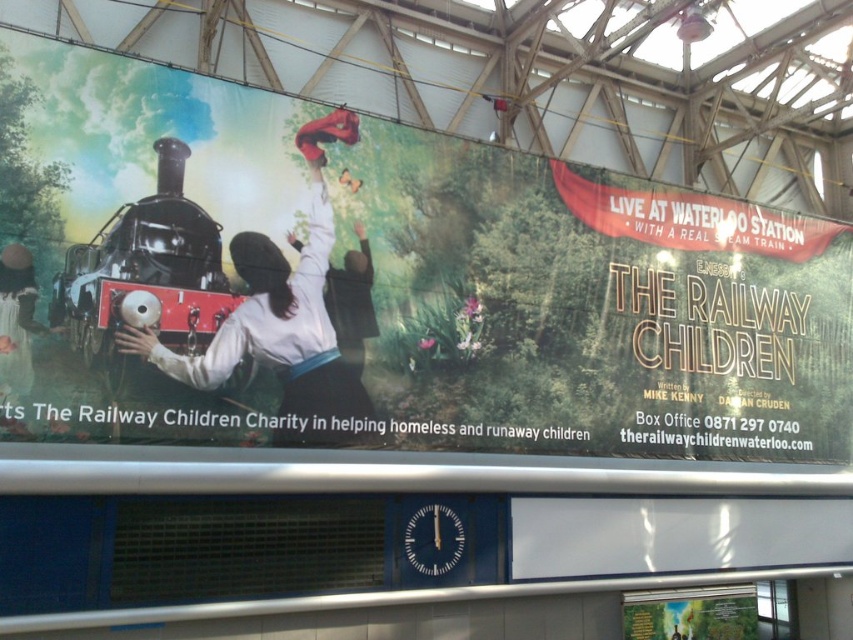
You are an artist analyzing the composition of the Waterloo Station advertisement banner. You notice the matte black train at upper left and the polished brass steam engine at left. Which object is located to the right of the other?

The matte black train at upper left is positioned on the right side of polished brass steam engine at left, so the matte black train at upper left is to the right of the polished brass steam engine at left.

You are an artist trying to recreate the advertisement banner from Waterloo Station. You need to ensure the proportions between the matte black train at upper left and the polished brass steam engine at left are accurate. Which object should you make wider?

The matte black train at upper left should be made wider than the polished brass steam engine at left since its width is larger according to the description.

You are a passenger at Waterloo Station looking at the advertisement banner for the play. You notice the matte black train at upper left and the polished brass steam engine at left. Which object is positioned lower on the banner?

The matte black train at upper left is positioned below the polished brass steam engine at left, so it is lower on the banner.